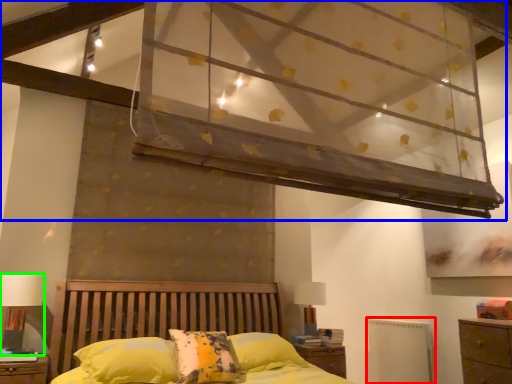
Question: Based on their relative distances, which object is farther from radiator (highlighted by a red box)? Choose from canopy bed (highlighted by a blue box) and table lamp (highlighted by a green box).

Choices:
 (A) canopy bed
 (B) table lamp

Answer: (B)